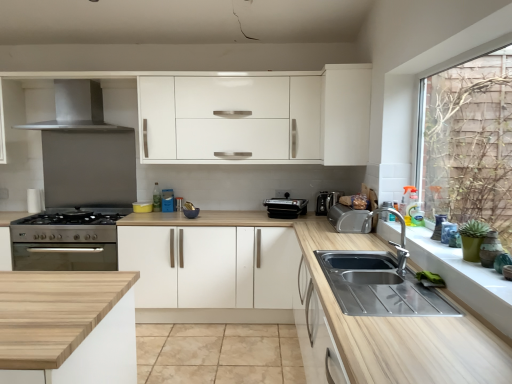
Question: Is point (392, 208) closer or farther from the camera than point (147, 289)?

Choices:
 (A) farther
 (B) closer

Answer: (B)

Question: From the image's perspective, is silver metallic tap at sink right positioned above or below white matte cabinet at center, the second cabinetry viewed from the top?

Choices:
 (A) below
 (B) above

Answer: (B)

Question: Which of these objects is positioned closest to the satin silver coffee machine at center?

Choices:
 (A) black plastic toaster at center, which is the second appliance in left-to-right order
 (B) satin silver toaster at right, which is counted as the 3th appliance, starting from the back
 (C) beige tile at center
 (D) silver metallic tap at sink right
 (E) satin silver exhaust hood at upper left

Answer: (A)

Question: Estimate the real-world distances between objects in this image. Which object is closer to the stainless steel cooker at left, which is the second appliance from back to front?

Choices:
 (A) matte green vase at right, arranged as the first appliance when viewed from the right
 (B) black plastic toaster at center, acting as the 1th appliance starting from the back
 (C) white matte cabinet at center, marked as the second cabinetry in a right-to-left arrangement
 (D) white matte cabinet at upper center, positioned as the 2th cabinetry in left-to-right order
 (E) wooden at center

Answer: (C)